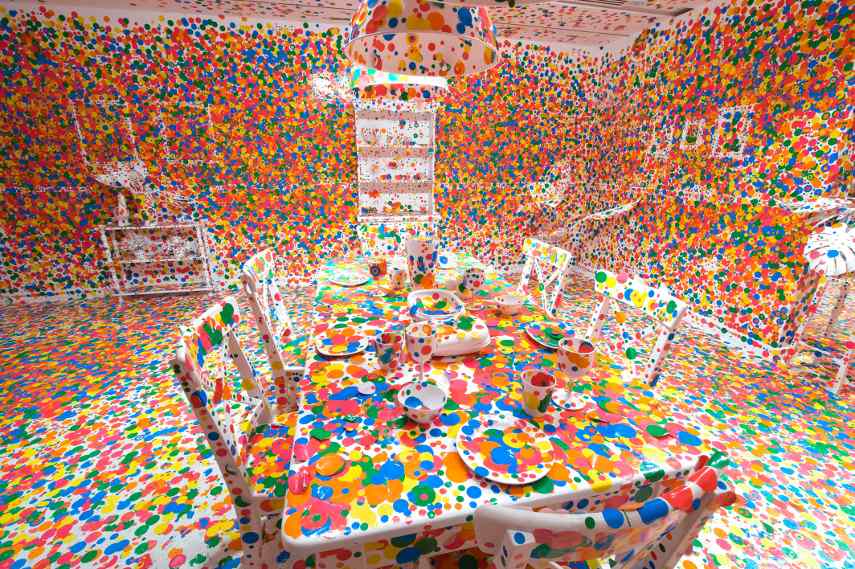
The height and width of the screenshot is (569, 855). Identify the location of table. (441, 504).